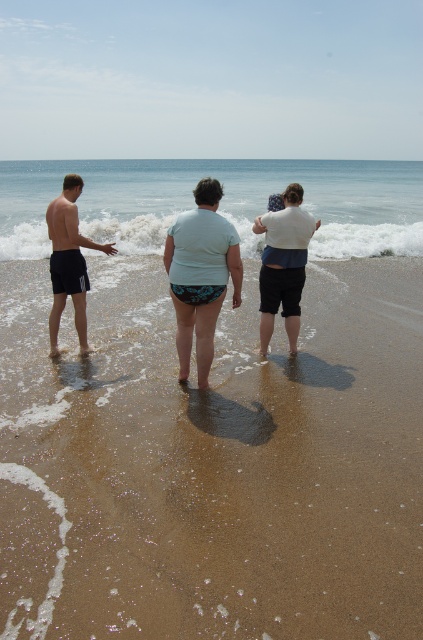
You are a photographer trying to capture the scene of the three people on the beach. You need to ensure that both the light blue fabric bikini bottom at center and the white cotton shirt at center are in focus. Given that your camera has a depth of field that can cover objects within 90 centimeters of each other, will both items be in focus?

The light blue fabric bikini bottom at center is 92.05 centimeters from the white cotton shirt at center. Since the distance between them exceeds the camera lens depth of field coverage of 90 centimeters, both items may not be in focus simultaneously.

You are a photographer trying to capture the scene. You notice the light blue fabric bikini bottom at center and the white cotton shirt at center. Which one appears wider in the photo?

The light blue fabric bikini bottom at center appears wider than the white cotton shirt at center because its width surpasses the shirt.